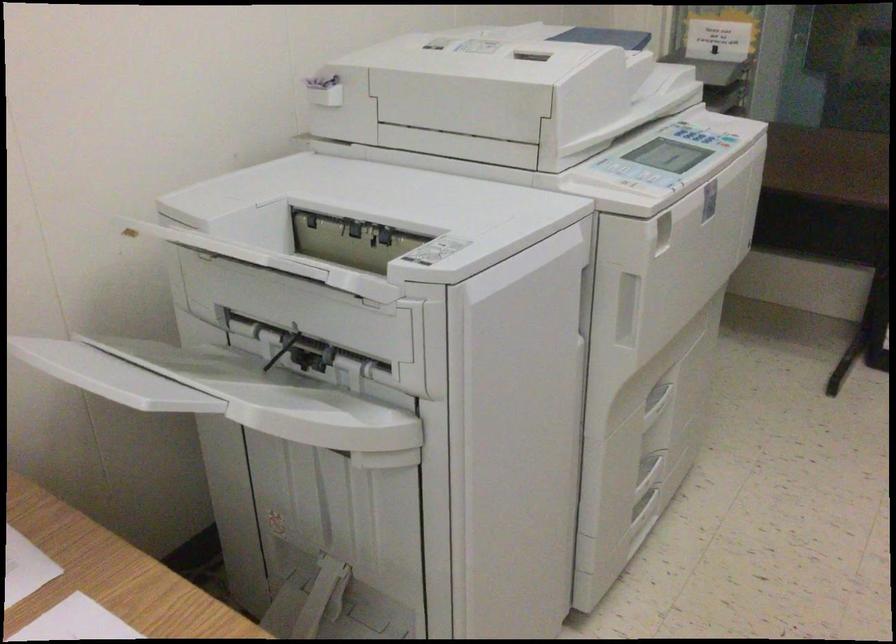
Where would you clos the open access panel? Please return your answer as a coordinate pair (x, y).

(304, 607)